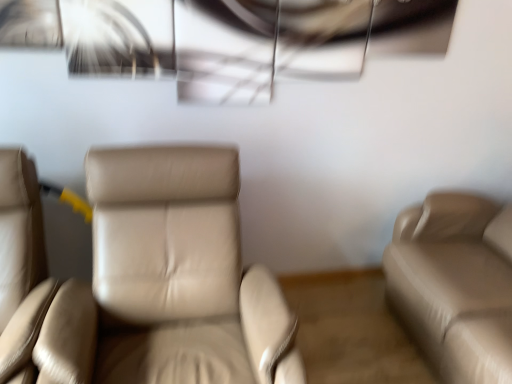
Question: Is beige leather chair at center, marked as the 1th chair in a right-to-left arrangement, positioned behind beige leather couch at right?

Choices:
 (A) yes
 (B) no

Answer: (B)

Question: Is beige leather chair at center, arranged as the 2th chair when viewed from the left, closer to the viewer compared to beige leather couch at right?

Choices:
 (A) yes
 (B) no

Answer: (A)

Question: Can you confirm if beige leather chair at center, marked as the 1th chair in a right-to-left arrangement, is thinner than beige leather couch at right?

Choices:
 (A) no
 (B) yes

Answer: (B)

Question: Can you confirm if beige leather chair at center, marked as the 1th chair in a right-to-left arrangement, is taller than beige leather couch at right?

Choices:
 (A) no
 (B) yes

Answer: (B)

Question: Can you confirm if beige leather chair at center, marked as the 1th chair in a right-to-left arrangement, is shorter than beige leather couch at right?

Choices:
 (A) no
 (B) yes

Answer: (A)

Question: From a real-world perspective, is beige leather chair at center, marked as the 1th chair in a right-to-left arrangement, located higher than beige leather couch at right?

Choices:
 (A) no
 (B) yes

Answer: (A)

Question: From a real-world perspective, is beige leather couch at right positioned under beige leather chair at left, acting as the second chair starting from the right, based on gravity?

Choices:
 (A) yes
 (B) no

Answer: (B)

Question: Does beige leather couch at right have a greater height compared to beige leather chair at left, which is the 1th chair from left to right?

Choices:
 (A) no
 (B) yes

Answer: (A)

Question: Is beige leather couch at right further to the viewer compared to beige leather chair at left, which is the 1th chair from left to right?

Choices:
 (A) yes
 (B) no

Answer: (A)

Question: Is beige leather couch at right with beige leather chair at left, acting as the second chair starting from the right?

Choices:
 (A) yes
 (B) no

Answer: (B)

Question: Is beige leather couch at right facing away from beige leather chair at left, which is the 1th chair from left to right?

Choices:
 (A) yes
 (B) no

Answer: (B)

Question: Is beige leather couch at right smaller than beige leather chair at left, which is the 1th chair from left to right?

Choices:
 (A) yes
 (B) no

Answer: (B)

Question: From a real-world perspective, is beige leather couch at right on top of beige leather chair at center, marked as the 1th chair in a right-to-left arrangement?

Choices:
 (A) yes
 (B) no

Answer: (A)